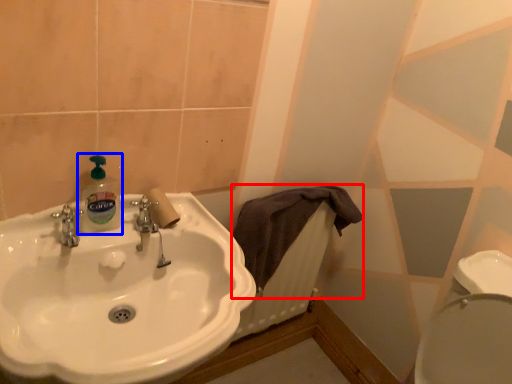
Question: Which of the following is the farthest to the observer, bath towel (highlighted by a red box) or cleaning product (highlighted by a blue box)?

Choices:
 (A) bath towel
 (B) cleaning product

Answer: (A)